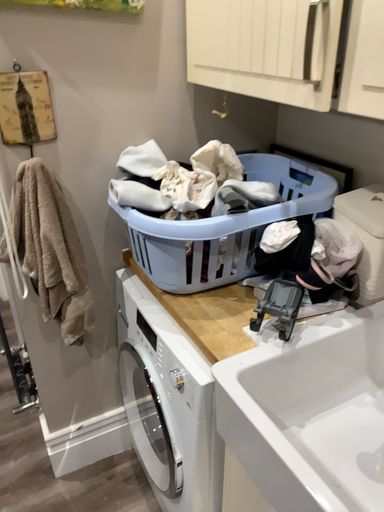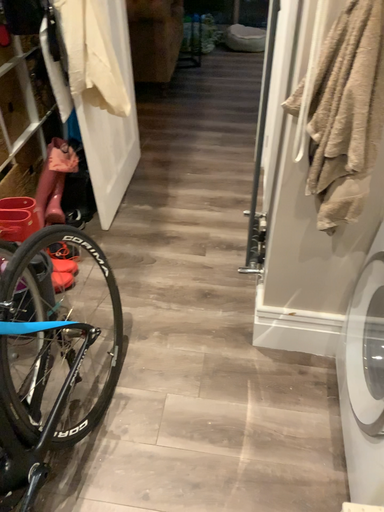
Question: Which way did the camera rotate in the video?

Choices:
 (A) rotated upward
 (B) rotated downward

Answer: (B)